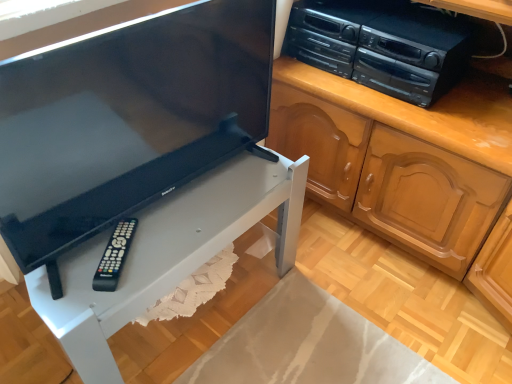
Question: From the image's perspective, would you say matte black television at center is shown under white matte table at lower left?

Choices:
 (A) yes
 (B) no

Answer: (B)

Question: Does matte black television at center turn towards white matte table at lower left?

Choices:
 (A) no
 (B) yes

Answer: (A)

Question: Is matte black television at center to the right of white matte table at lower left from the viewer's perspective?

Choices:
 (A) yes
 (B) no

Answer: (A)

Question: Is there a large distance between matte black television at center and white matte table at lower left?

Choices:
 (A) yes
 (B) no

Answer: (B)

Question: Is matte black television at center located outside white matte table at lower left?

Choices:
 (A) yes
 (B) no

Answer: (A)

Question: Are matte black television at center and white matte table at lower left making contact?

Choices:
 (A) yes
 (B) no

Answer: (B)

Question: Is white matte table at lower left at the back of black plastic remote at lower left?

Choices:
 (A) yes
 (B) no

Answer: (A)

Question: Can you confirm if black plastic remote at lower left is shorter than white matte table at lower left?

Choices:
 (A) yes
 (B) no

Answer: (A)

Question: Does black plastic remote at lower left have a greater height compared to white matte table at lower left?

Choices:
 (A) no
 (B) yes

Answer: (A)

Question: Considering the relative sizes of black plastic remote at lower left and white matte table at lower left in the image provided, is black plastic remote at lower left bigger than white matte table at lower left?

Choices:
 (A) no
 (B) yes

Answer: (A)

Question: Is white matte table at lower left located within black plastic remote at lower left?

Choices:
 (A) no
 (B) yes

Answer: (A)

Question: From a real-world perspective, is black plastic remote at lower left over white matte table at lower left?

Choices:
 (A) no
 (B) yes

Answer: (B)

Question: Is black plastic stereo at upper right next to matte black television at center?

Choices:
 (A) yes
 (B) no

Answer: (B)